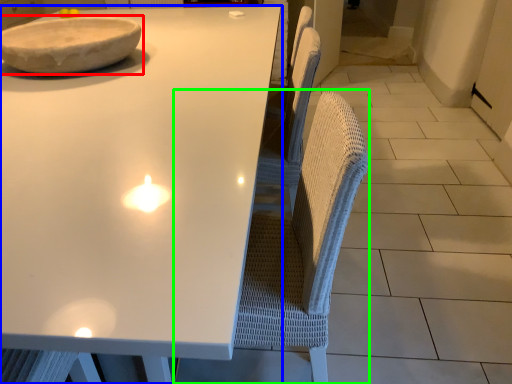
Question: Considering the real-world distances, which object is farthest from bowl (highlighted by a red box)? table (highlighted by a blue box) or swivel chair (highlighted by a green box)?

Choices:
 (A) table
 (B) swivel chair

Answer: (B)